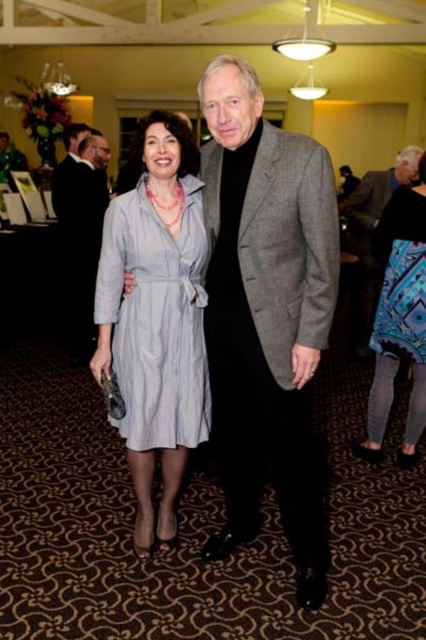
Question: Which point is closer to the camera taking this photo?

Choices:
 (A) (417, 228)
 (B) (186, 228)

Answer: (B)

Question: Can you confirm if gray wool blazer at center is positioned to the left of blue patterned dress at lower right?

Choices:
 (A) yes
 (B) no

Answer: (A)

Question: Is light blue linen dress at center bigger than black suit at left?

Choices:
 (A) no
 (B) yes

Answer: (A)

Question: Does gray wool blazer at center have a lesser width compared to blue patterned fabric dress at lower right?

Choices:
 (A) yes
 (B) no

Answer: (B)

Question: Which object is farther from the camera taking this photo?

Choices:
 (A) blue patterned dress at lower right
 (B) black suit at left

Answer: (B)

Question: Estimate the real-world distances between objects in this image. Which object is farther from the gray wool blazer at center?

Choices:
 (A) black suit at left
 (B) light blue linen dress at center

Answer: (A)